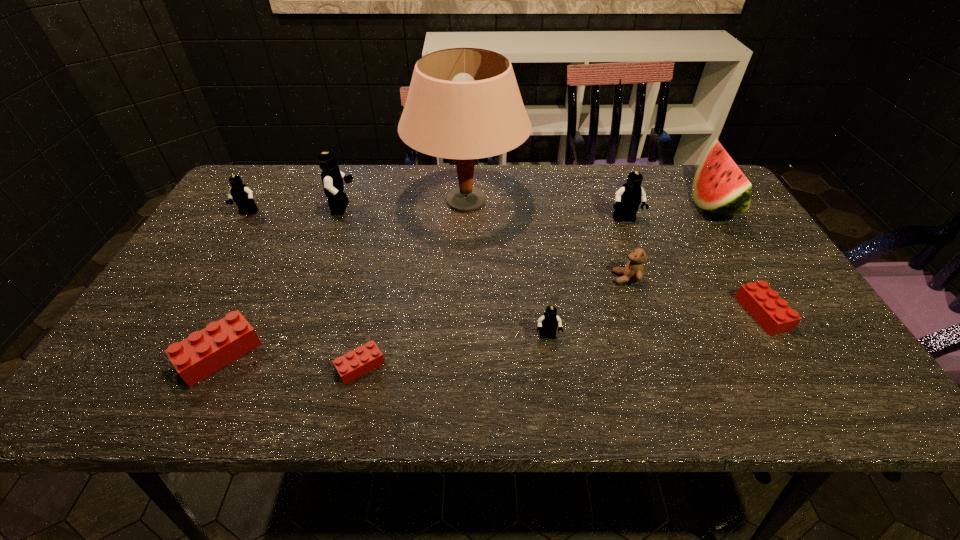
Find the location of a particular element. brown teddy bear is located at coordinates (633, 271).

You are a GUI agent. You are given a task and a screenshot of the screen. Output one action in this format:
    pyautogui.click(x=<x>, y=<y>)
    Task: Click on the nearest black Lego
    The width and height of the screenshot is (960, 540).
    Given the screenshot: What is the action you would take?
    pyautogui.click(x=548, y=323)

This screenshot has width=960, height=540. I want to click on the third Lego from right to left, so click(x=548, y=323).

Find the location of a particular element. This screenshot has height=540, width=960. the second Lego from left to right is located at coordinates (204, 352).

Locate an element on the screen. The width and height of the screenshot is (960, 540). the leftmost red Lego is located at coordinates (204, 352).

Where is `the second shortest object`? This screenshot has width=960, height=540. the second shortest object is located at coordinates (772, 313).

Locate an element on the screen. The image size is (960, 540). the rightmost red Lego is located at coordinates (772, 313).

Identify the location of the fourth Lego from left to right. (353, 364).

You are a GUI agent. You are given a task and a screenshot of the screen. Output one action in this format:
    pyautogui.click(x=<x>, y=<y>)
    Task: Click on the shortest Lego
    The width and height of the screenshot is (960, 540).
    Given the screenshot: What is the action you would take?
    pyautogui.click(x=353, y=364)

Where is `free space located on the front-facing side of the brown lampshade`? free space located on the front-facing side of the brown lampshade is located at coordinates (602, 202).